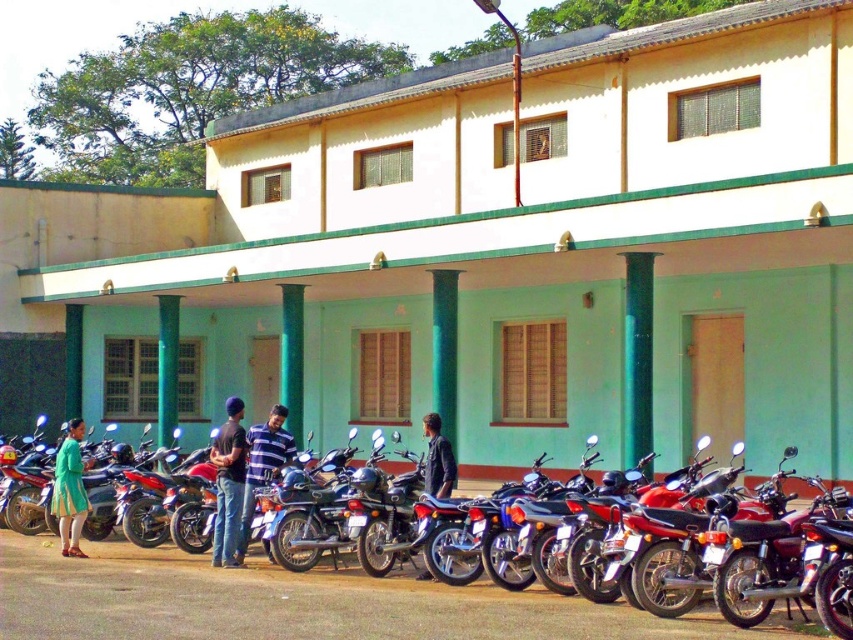
Question: Which object is farther from the camera taking this photo?

Choices:
 (A) dark blue leather jacket at center
 (B) shiny black motorcycle at center
 (C) dark blue shirt at center
 (D) striped fabric shirt at center

Answer: (D)

Question: Which point is farther from the camera taking this photo?

Choices:
 (A) (454, 476)
 (B) (263, 467)

Answer: (B)

Question: Can you confirm if matte green dress at lower left is positioned below dark blue fabric shirt at center?

Choices:
 (A) no
 (B) yes

Answer: (B)

Question: Among these points, which one is farthest from the camera?

Choices:
 (A) (241, 497)
 (B) (277, 422)
 (C) (378, 634)
 (D) (451, 460)

Answer: (B)

Question: Does dark blue leather jacket at center have a lesser width compared to dark blue fabric shirt at center?

Choices:
 (A) yes
 (B) no

Answer: (B)

Question: Can you confirm if shiny black motorcycle at center is smaller than striped fabric shirt at center?

Choices:
 (A) yes
 (B) no

Answer: (A)